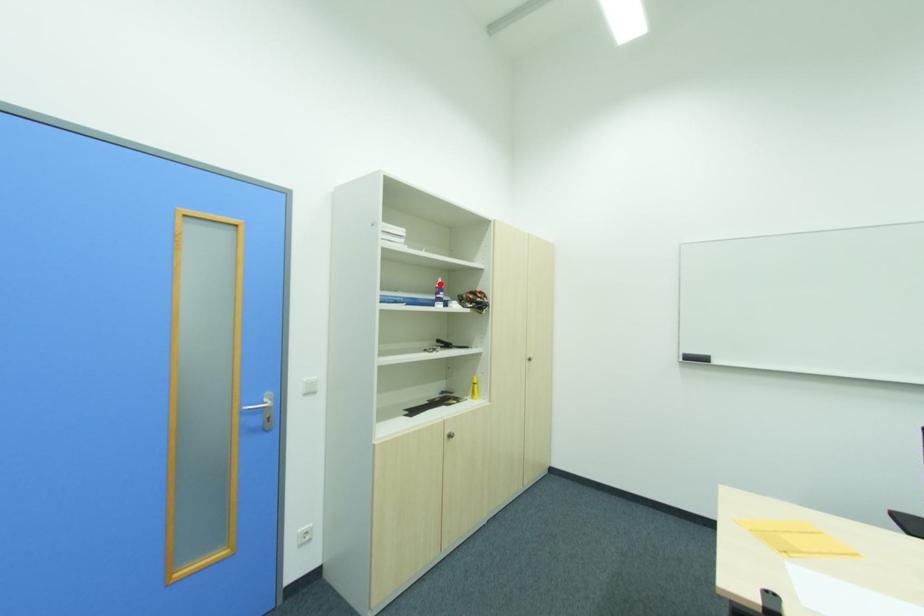
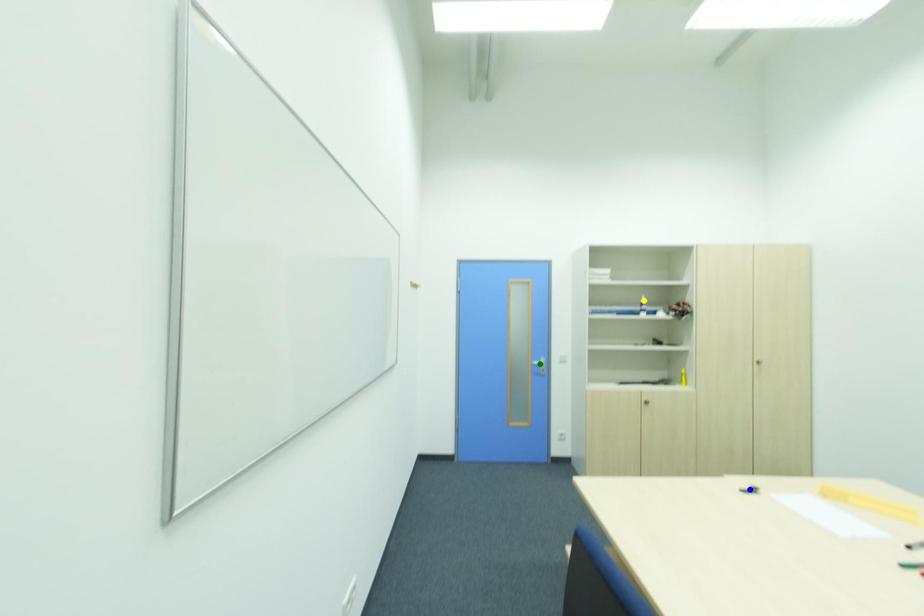
Question: I am providing you with two images of the same scene from different viewpoints. A red point is marked on the first image. You are given multiple points on the second image. Which point in image 2 represents the same 3d spot as the red point in image 1?

Choices:
 (A) yellow point
 (B) green point
 (C) blue point

Answer: (A)